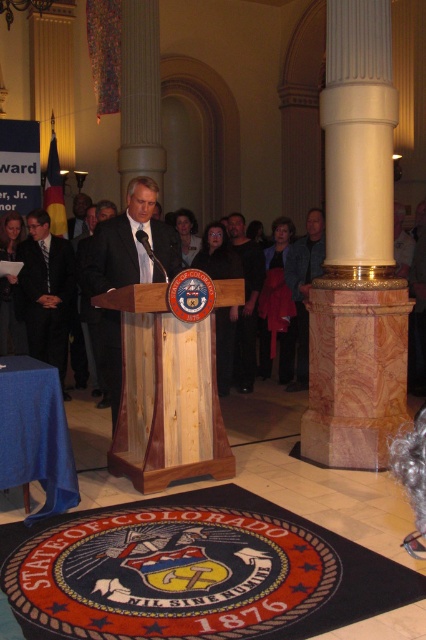
Is natural wood podium at center taller than dark gray suit at center?

No.

Does natural wood podium at center come in front of dark gray suit at center?

That is True.

Who is more forward, (161, 433) or (39, 275)?

Point (161, 433)

The image size is (426, 640). I want to click on natural wood podium at center, so click(x=166, y=394).

Does dark gray suit at center have a lesser height compared to dark blue shirt at center?

Yes.

Can you confirm if dark gray suit at center is positioned below dark blue shirt at center?

No, dark gray suit at center is not below dark blue shirt at center.

This screenshot has height=640, width=426. I want to click on dark gray suit at center, so click(46, 296).

Is matte black suit at center above dark blue shirt at center?

Incorrect, matte black suit at center is not positioned above dark blue shirt at center.

Is the position of matte black suit at center less distant than that of dark blue shirt at center?

That is True.

Does point (97, 262) come farther from viewer compared to point (305, 294)?

No, (97, 262) is in front of (305, 294).

The height and width of the screenshot is (640, 426). In order to click on matte black suit at center in this screenshot , I will do `click(132, 243)`.